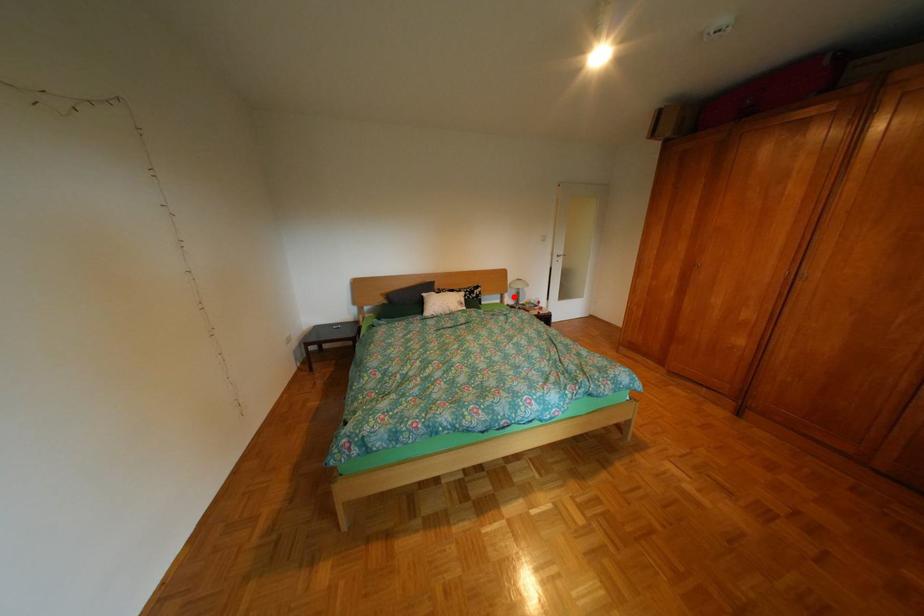
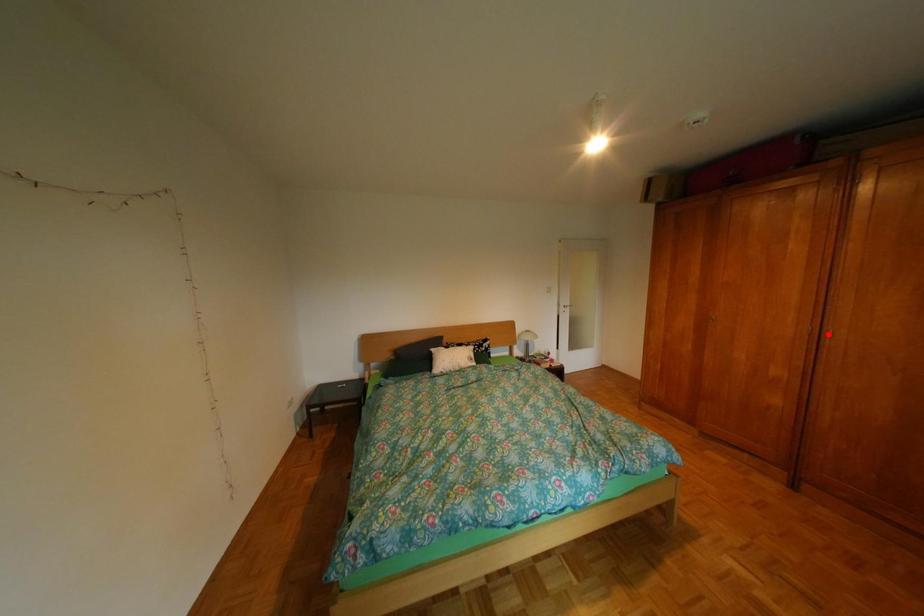
I am providing you with two images of the same scene from different viewpoints. A red point is marked on the first image and another point is marked on the second image. Are the points marked in image1 and image2 representing the same 3D position?

No